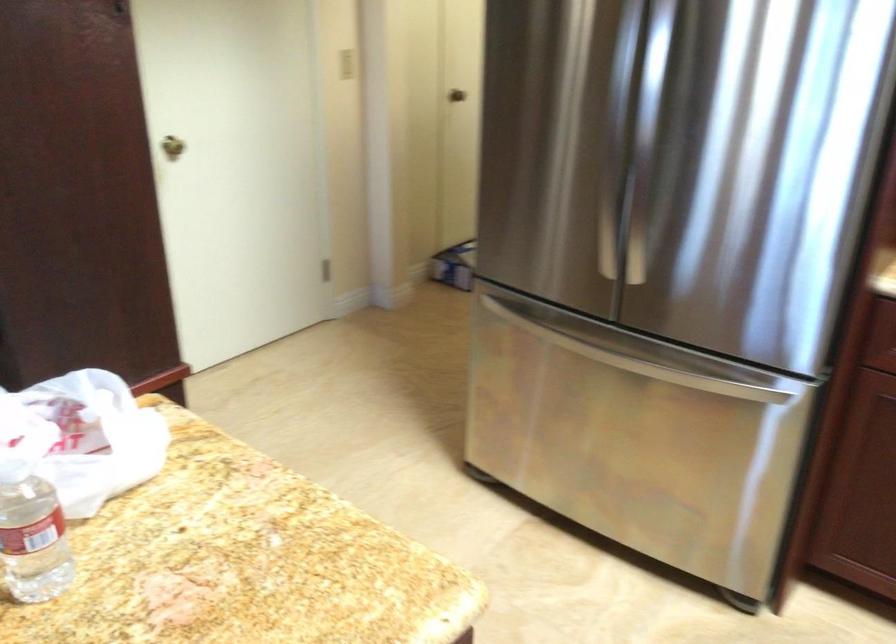
Where would you turn the brass door knob? Please return your answer as a coordinate pair (x, y).

(171, 146)